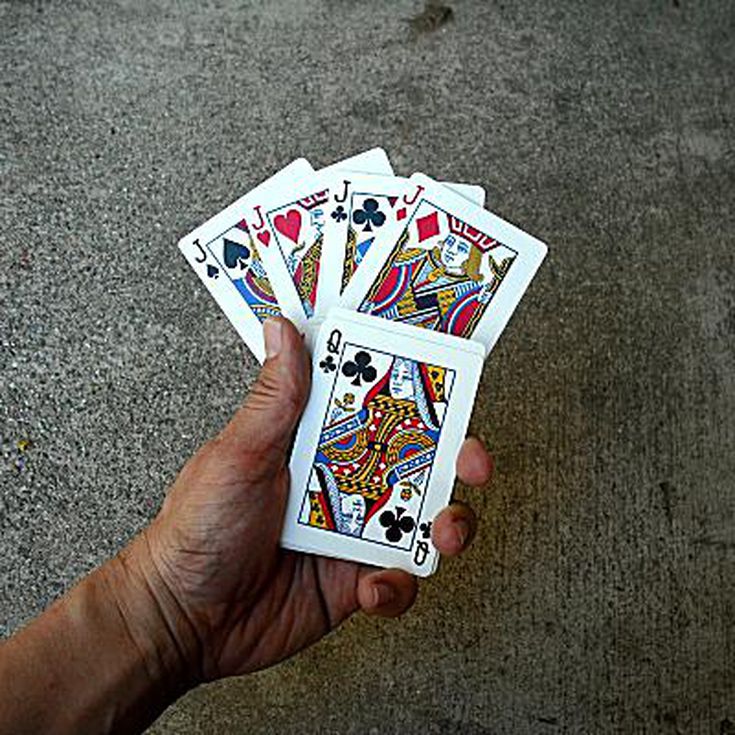
Identify the location of table top or counter top. This screenshot has height=735, width=735. (115, 231).